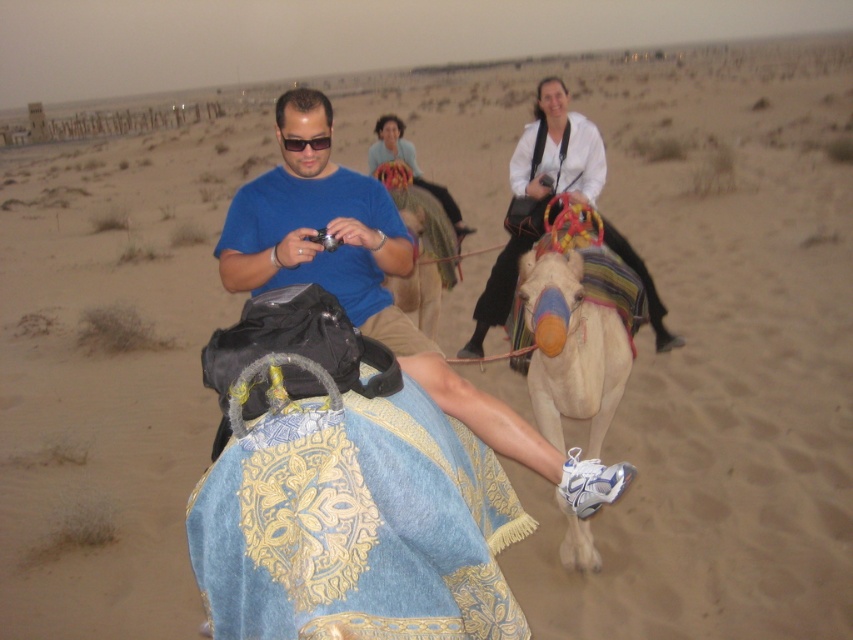
Question: Can you confirm if blue cotton shirt at center is thinner than light blue fabric at center?

Choices:
 (A) no
 (B) yes

Answer: (B)

Question: Does white matte shirt at upper center appear on the left side of light beige fabric camel at center?

Choices:
 (A) no
 (B) yes

Answer: (A)

Question: Which point is closer to the camera?

Choices:
 (A) (558, 161)
 (B) (328, 141)

Answer: (B)

Question: Observing the image, what is the correct spatial positioning of white fabric camel at center in reference to white matte shirt at upper center?

Choices:
 (A) below
 (B) above

Answer: (A)

Question: Which point is closer to the camera taking this photo?

Choices:
 (A) (384, 157)
 (B) (401, 285)
 (C) (286, 156)

Answer: (C)

Question: Among these points, which one is nearest to the camera?

Choices:
 (A) (392, 554)
 (B) (361, 216)
 (C) (442, 196)
 (D) (416, 234)

Answer: (A)